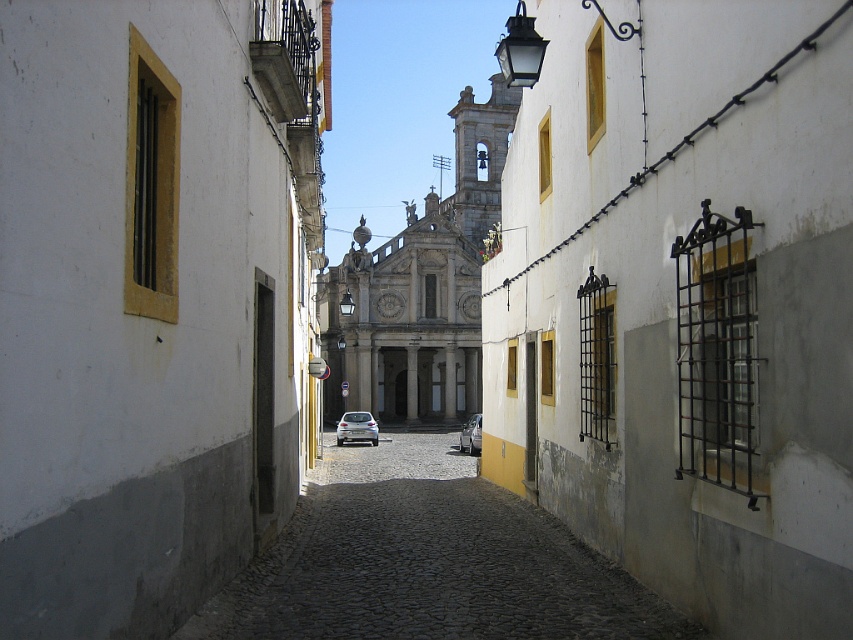
You are standing at the entrance of the narrow cobblestone street and see two points marked in the scene. Which point, point (467, 211) or point (476, 422), is closer to you as you face the street?

Point (467, 211) is further to the camera than point (476, 422), so the closer point to you is point (476, 422).

You are standing at the entrance of the narrow cobblestone street and want to walk straight ahead towards the end of the alley. According to the image, where exactly is the smooth cobblestone alley at center located in terms of coordinates?

The smooth cobblestone alley at center is located at coordinates point (426, 561).